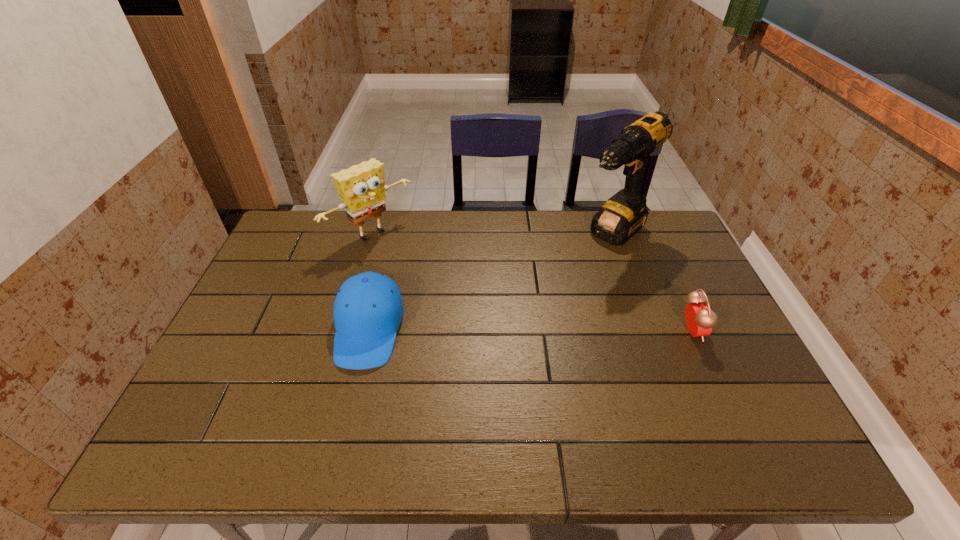
The width and height of the screenshot is (960, 540). In order to click on free location at the right edge in this screenshot , I will do `click(671, 271)`.

Locate an element on the screen. vacant space at the far left corner of the desktop is located at coordinates (303, 239).

I want to click on free region at the far right corner of the desktop, so click(640, 243).

Where is `vacant space in between the drill and the third shortest object`? This screenshot has height=540, width=960. vacant space in between the drill and the third shortest object is located at coordinates (492, 235).

Find the location of `empty location between the alarm clock and the cap`. empty location between the alarm clock and the cap is located at coordinates (530, 330).

At what (x,y) coordinates should I click in order to perform the action: click on free point between the cap and the drill. Please return your answer as a coordinate pair (x, y). The height and width of the screenshot is (540, 960). Looking at the image, I should click on (491, 282).

This screenshot has width=960, height=540. Identify the location of vacant space that's between the alarm clock and the drill. (652, 283).

I want to click on vacant space that is in between the tallest object and the alarm clock, so click(652, 283).

You are a GUI agent. You are given a task and a screenshot of the screen. Output one action in this format:
    pyautogui.click(x=<x>, y=<y>)
    Task: Click on the free point between the second tallest object and the tallest object
    
    Given the screenshot: What is the action you would take?
    pyautogui.click(x=492, y=235)

This screenshot has width=960, height=540. What are the coordinates of `free spot between the cap and the alarm clock` in the screenshot? It's located at (530, 330).